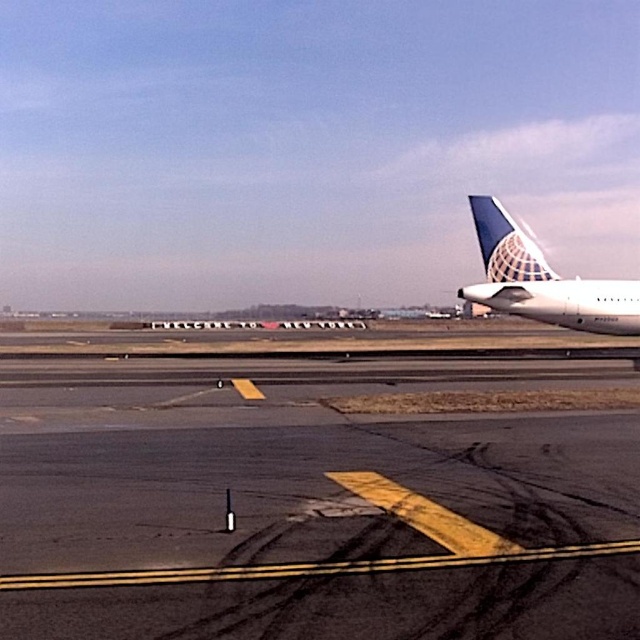
Is white glossy airplane at right bigger than blue textured tail fin at right?

Incorrect, white glossy airplane at right is not larger than blue textured tail fin at right.

Does point (627, 296) lie in front of point (524, 272)?

No, (627, 296) is further to viewer.

The width and height of the screenshot is (640, 640). Describe the element at coordinates (541, 282) in the screenshot. I see `white glossy airplane at right` at that location.

This screenshot has height=640, width=640. I want to click on white glossy airplane at right, so tap(541, 282).

Which is behind, point (214, 371) or point (474, 211)?

The point (474, 211) is more distant.

Who is taller, black asphalt tarmac at center or blue textured tail fin at right?

With more height is blue textured tail fin at right.

Locate an element on the screen. The width and height of the screenshot is (640, 640). black asphalt tarmac at center is located at coordinates (321, 486).

This screenshot has height=640, width=640. I want to click on black asphalt tarmac at center, so click(x=321, y=486).

Can you confirm if black asphalt tarmac at center is smaller than white glossy airplane at right?

Correct, black asphalt tarmac at center occupies less space than white glossy airplane at right.

This screenshot has height=640, width=640. Find the location of `black asphalt tarmac at center`. black asphalt tarmac at center is located at coordinates (321, 486).